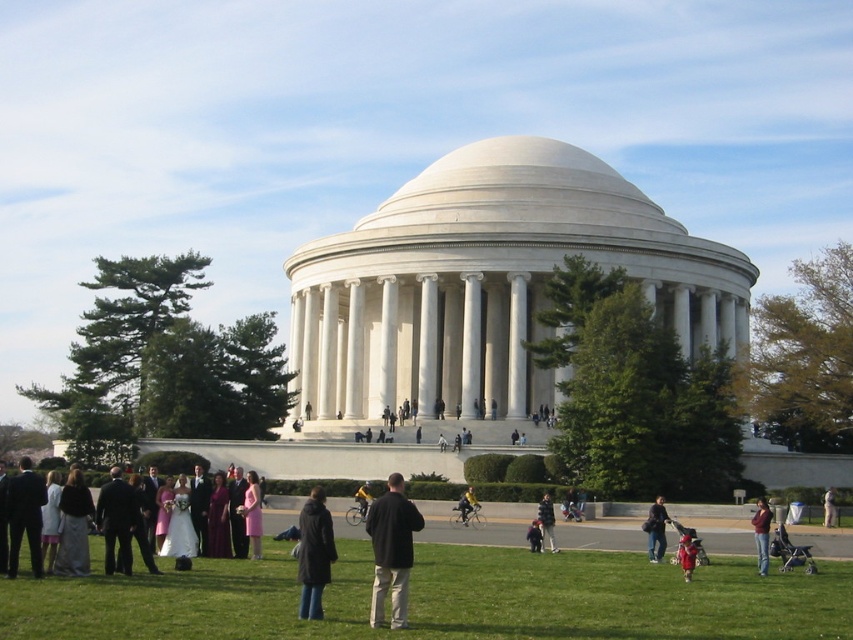
Question: Does matte white dress at center have a smaller size compared to dark blue jacket at center?

Choices:
 (A) no
 (B) yes

Answer: (A)

Question: Can you confirm if matte white dress at center is wider than white cotton baseball uniform at center?

Choices:
 (A) yes
 (B) no

Answer: (A)

Question: Which object is the closest to the dark blue jeans at lower center?

Choices:
 (A) red fabric dress at lower right
 (B) green grass at lower center
 (C) black matte jacket at center
 (D) white cotton baseball uniform at center

Answer: (A)

Question: Among these points, which one is nearest to the camera?

Choices:
 (A) (688, 570)
 (B) (657, 522)
 (C) (763, 536)

Answer: (A)

Question: Which object is the closest to the black matte jacket at center?

Choices:
 (A) dark blue jacket at center
 (B) white cotton baseball uniform at center
 (C) matte white dress at center

Answer: (C)

Question: Where is pink satin dress at center located in relation to white cotton baseball uniform at center in the image?

Choices:
 (A) right
 (B) left

Answer: (B)